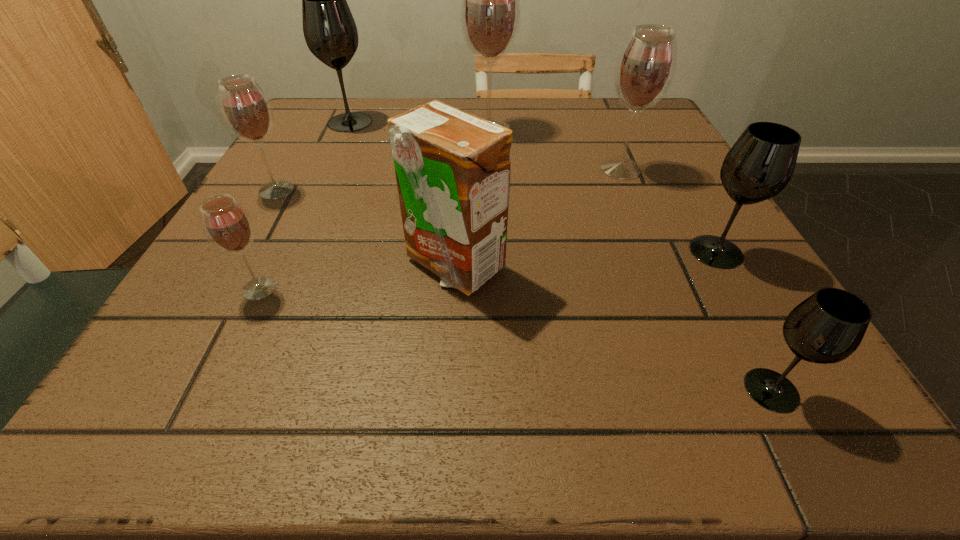
At what (x,y) coordinates should I click in order to perform the action: click on the second red wineglass from right to left. Please return your answer as a coordinate pair (x, y). This screenshot has height=540, width=960. Looking at the image, I should click on (490, 12).

The image size is (960, 540). Find the location of `the biggest red wineglass`. the biggest red wineglass is located at coordinates (490, 12).

At what (x,y) coordinates should I click in order to perform the action: click on the leftmost gray wineglass. Please return your answer as a coordinate pair (x, y). This screenshot has width=960, height=540. Looking at the image, I should click on (330, 32).

Image resolution: width=960 pixels, height=540 pixels. Identify the location of the farthest gray wineglass. pos(330,32).

The height and width of the screenshot is (540, 960). I want to click on the second biggest red wineglass, so click(645, 68).

I want to click on carton, so click(x=452, y=168).

Where is `the second smallest red wineglass`? the second smallest red wineglass is located at coordinates (246, 110).

Locate an element on the screen. The height and width of the screenshot is (540, 960). the second farthest gray wineglass is located at coordinates (759, 165).

I want to click on the second smallest gray wineglass, so click(759, 165).

The height and width of the screenshot is (540, 960). In order to click on the second nearest wineglass in this screenshot , I will do `click(227, 225)`.